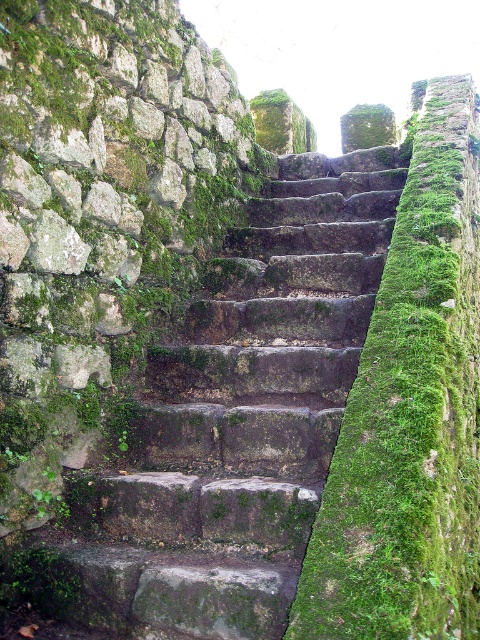
Question: Can you confirm if rusty stone stairs at center is positioned to the left of green mossy wall at center?

Choices:
 (A) yes
 (B) no

Answer: (A)

Question: Which point is farther from the camera taking this photo?

Choices:
 (A) (167, 474)
 (B) (410, 156)

Answer: (B)

Question: Is rusty stone stairs at center behind green mossy wall at center?

Choices:
 (A) no
 (B) yes

Answer: (B)

Question: Is rusty stone stairs at center to the left of green mossy wall at center from the viewer's perspective?

Choices:
 (A) no
 (B) yes

Answer: (B)